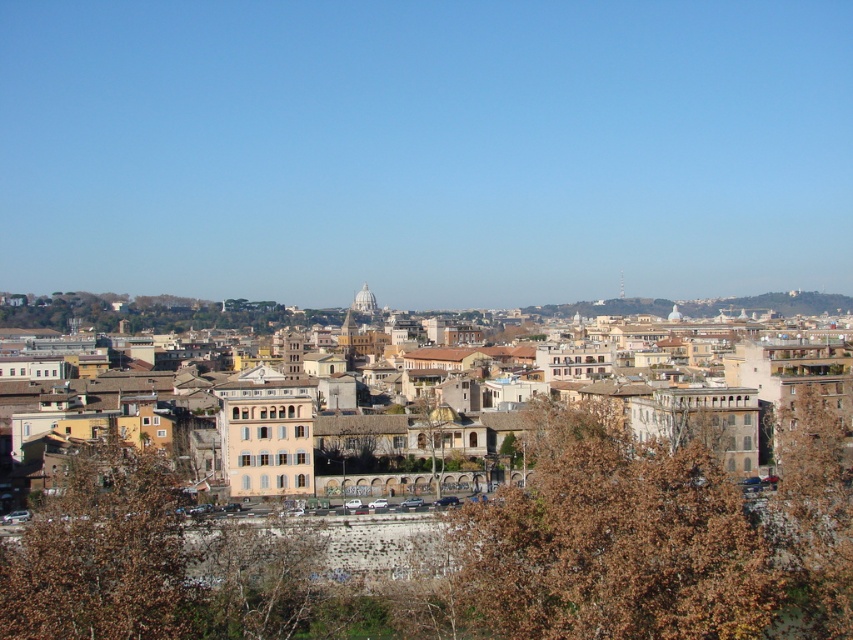
Between brown leafy tree at lower left and brown textured tree at center, which one appears on the right side from the viewer's perspective?

brown textured tree at center is more to the right.

Can you confirm if brown leafy tree at lower left is taller than brown textured tree at center?

Yes, brown leafy tree at lower left is taller than brown textured tree at center.

Locate an element on the screen. brown leafy tree at lower left is located at coordinates (100, 556).

Is brown leafy tree at lower center further to camera compared to brown leafy tree at lower left?

Yes, brown leafy tree at lower center is behind brown leafy tree at lower left.

Does brown leafy tree at lower center have a lesser width compared to brown leafy tree at lower left?

No.

Is point (645, 486) more distant than point (113, 573)?

Yes, point (645, 486) is behind point (113, 573).

What are the coordinates of `brown leafy tree at lower center` in the screenshot? It's located at (648, 541).

Can you confirm if brown leafy tree at lower left is shorter than brown leafy tree at right?

Indeed, brown leafy tree at lower left has a lesser height compared to brown leafy tree at right.

Between brown leafy tree at lower left and brown leafy tree at right, which one is positioned higher?

brown leafy tree at lower left is higher up.

Where is `brown leafy tree at lower left`? This screenshot has height=640, width=853. brown leafy tree at lower left is located at coordinates (100, 556).